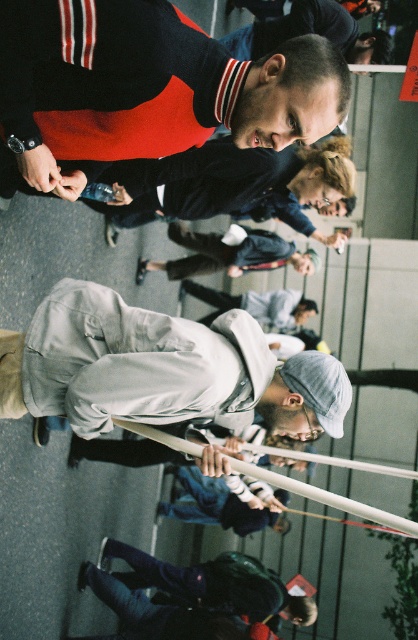
Where is `dark blue sweater at upper center`? This screenshot has height=640, width=418. dark blue sweater at upper center is located at coordinates (234, 184).

Describe the element at coordinates (234, 184) in the screenshot. Image resolution: width=418 pixels, height=640 pixels. I see `dark blue sweater at upper center` at that location.

Identify the location of dark blue sweater at upper center. This screenshot has height=640, width=418. (234, 184).

Can you confirm if matte black sweater at upper center is thinner than light gray fabric jacket at center?

Indeed, matte black sweater at upper center has a lesser width compared to light gray fabric jacket at center.

The width and height of the screenshot is (418, 640). I want to click on matte black sweater at upper center, so click(x=147, y=88).

The image size is (418, 640). Find the location of `matte black sweater at upper center`. matte black sweater at upper center is located at coordinates (147, 88).

Does matte black sweater at upper center appear on the right side of light gray cotton jacket at center?

In fact, matte black sweater at upper center is to the left of light gray cotton jacket at center.

Who is taller, matte black sweater at upper center or light gray cotton jacket at center?

light gray cotton jacket at center is taller.

At what (x,y) coordinates should I click in order to perform the action: click on matte black sweater at upper center. Please return your answer as a coordinate pair (x, y). The height and width of the screenshot is (640, 418). Looking at the image, I should click on (147, 88).

I want to click on matte black sweater at upper center, so click(x=147, y=88).